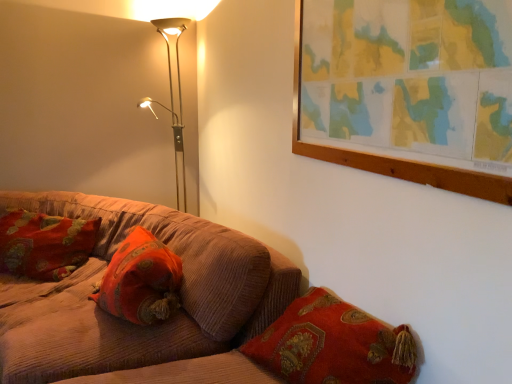
Question: From the image's perspective, is corduroy couch at lower left above or below velvet orange pillow at center, the first pillow in the right-to-left sequence?

Choices:
 (A) above
 (B) below

Answer: (B)

Question: Is corduroy couch at lower left in front of or behind velvet orange pillow at center, the first pillow in the right-to-left sequence, in the image?

Choices:
 (A) front
 (B) behind

Answer: (A)

Question: Which object is positioned farthest from the velvet orange pillow at center, marked as the second pillow in a left-to-right arrangement?

Choices:
 (A) velvet cushion at left, placed as the second pillow when sorted from front to back
 (B) metallic floor lamp at upper left
 (C) corduroy couch at lower left

Answer: (B)

Question: Considering the real-world distances, which object is farthest from the metallic floor lamp at upper left?

Choices:
 (A) velvet cushion at left, placed as the second pillow when sorted from front to back
 (B) corduroy couch at lower left
 (C) velvet orange pillow at center, marked as the second pillow in a left-to-right arrangement

Answer: (C)